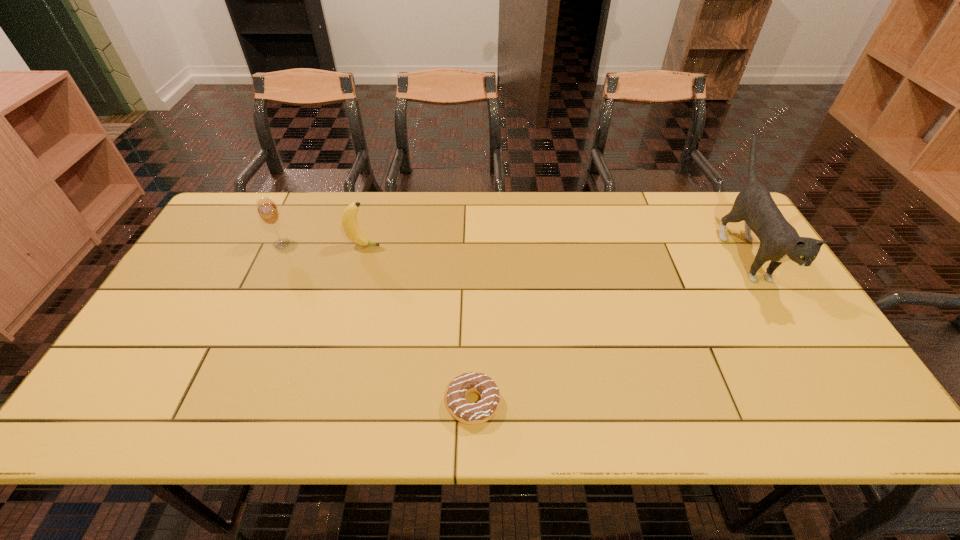
Identify the location of cat at the far edge. (779, 241).

I want to click on wineglass present at the far edge, so click(268, 212).

At what (x,y) coordinates should I click in order to perform the action: click on object that is positioned at the near edge. Please return your answer as a coordinate pair (x, y). Looking at the image, I should click on (462, 410).

You are a GUI agent. You are given a task and a screenshot of the screen. Output one action in this format:
    pyautogui.click(x=<x>, y=<y>)
    Task: Click on the object at the right edge
    
    Given the screenshot: What is the action you would take?
    pyautogui.click(x=779, y=241)

The height and width of the screenshot is (540, 960). Find the location of `object that is at the far right corner`. object that is at the far right corner is located at coordinates [779, 241].

This screenshot has width=960, height=540. I want to click on free space at the far edge of the desktop, so click(584, 227).

In the image, there is a desktop. Identify the location of vacant space at the near edge. Image resolution: width=960 pixels, height=540 pixels. (444, 406).

Identify the location of vacant region at the left edge of the desktop. (223, 251).

Image resolution: width=960 pixels, height=540 pixels. In the image, there is a desktop. In order to click on vacant area at the right edge in this screenshot , I will do `click(721, 246)`.

In the image, there is a desktop. Identify the location of vacant space at the far right corner. The image size is (960, 540). coord(709,221).